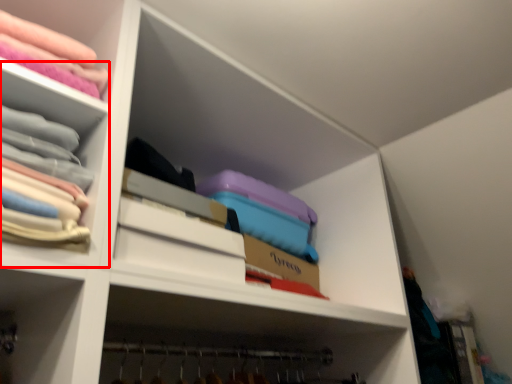
Question: From the image's perspective, considering the relative positions of cabinet (annotated by the red box) and shelf in the image provided, where is cabinet (annotated by the red box) located with respect to the staircase?

Choices:
 (A) above
 (B) below

Answer: (B)